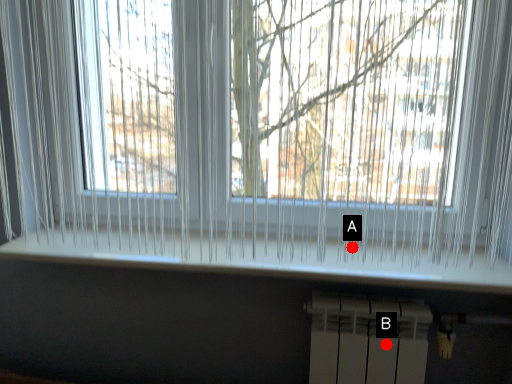
Question: Two points are circled on the image, labeled by A and B beside each circle. Which point appears closest to the camera in this image?

Choices:
 (A) A is closer
 (B) B is closer

Answer: (A)